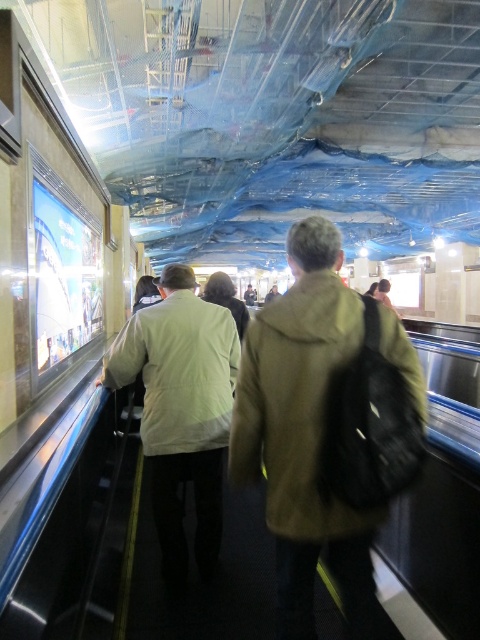
You are standing at the bottom of the escalator in the subway station. You notice two points marked in the scene. The first point is at coordinates point (326,531) and the second is at point (227,328). If you want to reach the point that is closer to you, which one should you head towards?

You should head towards point (326,531) because it is closer to the viewer than point (227,328).

Looking at this image, you are standing at the bottom of the escalator and want to hand a note to the person wearing the brown woolen jacket at center. If your arm can reach up to 1.5 meters, can you reach them?

The brown woolen jacket at center is 1.48 meters away from the camera. Since your arm can reach up to 1.5 meters, you can just barely reach them to hand the note.

You are standing at the camera position and want to pick up an object located at point [322,298]. Can you reach it without moving your feet?

The point [322,298] is 1.58 meters away from the camera, so you can reach it without moving your feet if your arm length is at least 1.58 meters. However, typical human arm length is about 0.7 meters, so it might be difficult to reach without moving.